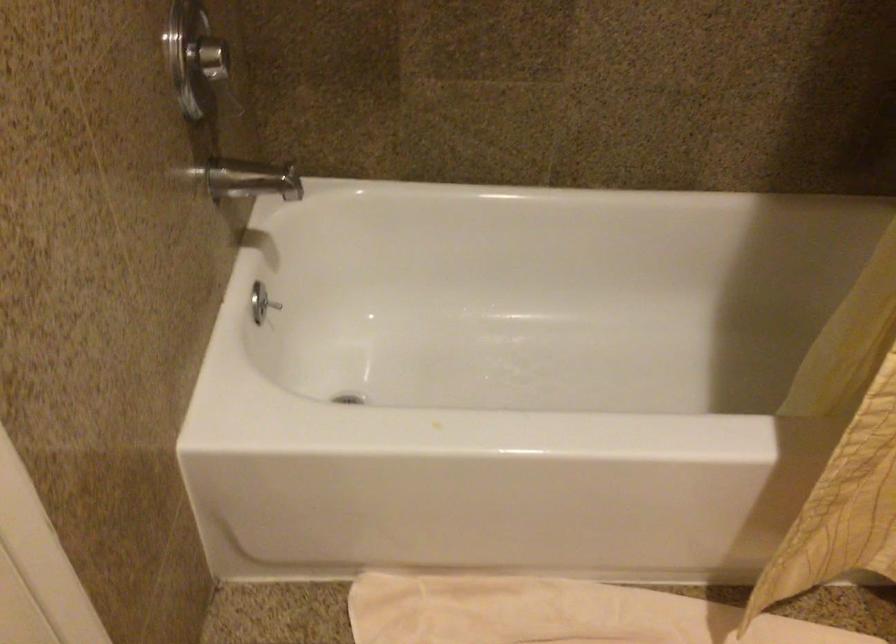
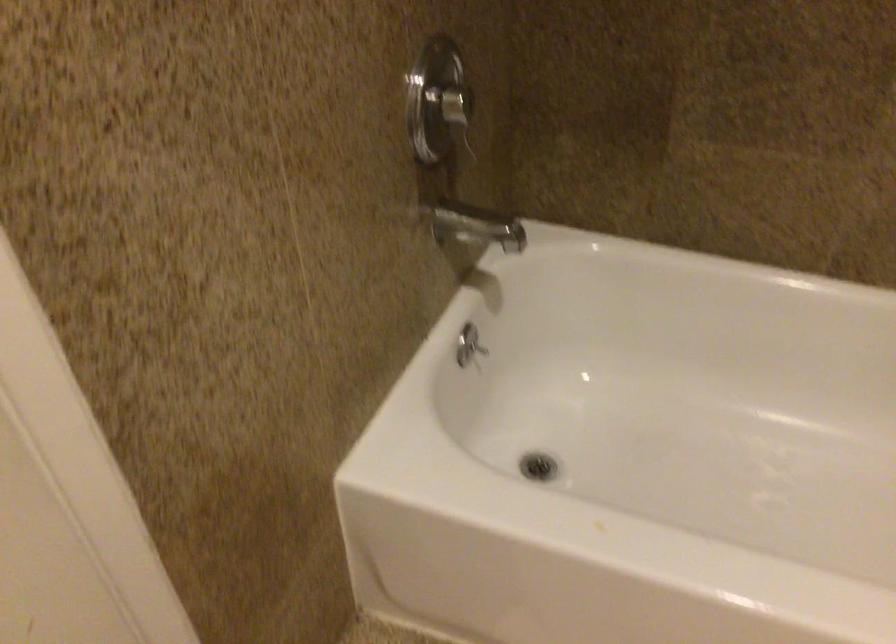
Find the pixel in the second image that matches pixel 268 313 in the first image.

(478, 348)